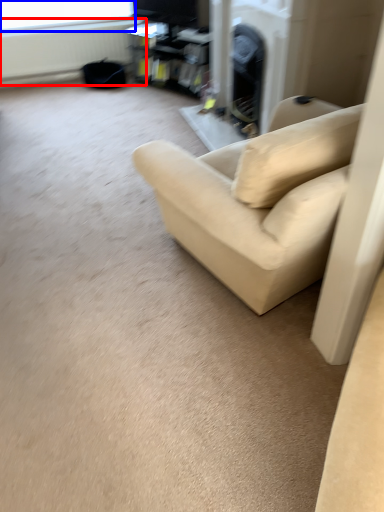
Question: Among these objects, which one is nearest to the camera, radiator (highlighted by a red box) or window screen (highlighted by a blue box)?

Choices:
 (A) radiator
 (B) window screen

Answer: (B)